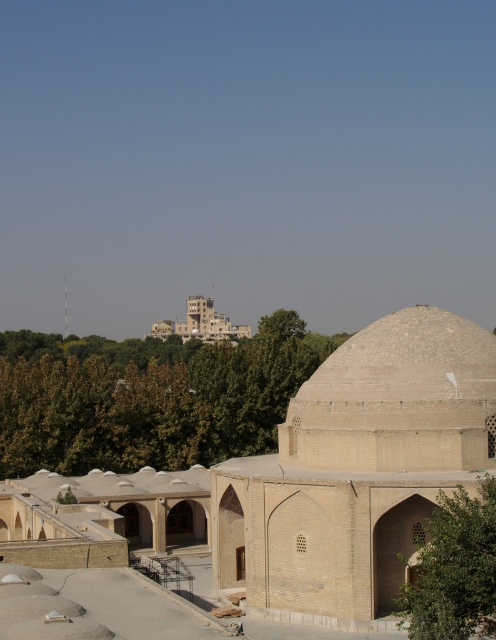
You are standing at the entrance of the beige brick mosque at center. If you walk straight ahead, will you exit the complex through the main gate located at the northern boundary?

The beige brick mosque at center is located at point (x=338, y=474). Since the main gate is at the northern boundary, walking straight ahead from the mosque would head north, so yes, exiting through the main gate is possible.

You are standing in front of the architectural complex described. A guide tells you there is a hidden entrance located at point (461, 321). Considering the distance from where you are standing, can you estimate whether this entrance is within a 100 meter radius from your current position?

The point (461, 321) is 73.45 meters away from the viewer, which is within the 100 meter radius, so yes, the entrance is within the specified distance.

You are standing at the entrance of the complex and see two points marked in the image. The first point is at coordinates point [338,474] and the second point is at point [348,438]. Which point is closer to you as you face the complex?

Point [338,474] is closer to you because it is in front of point [348,438].